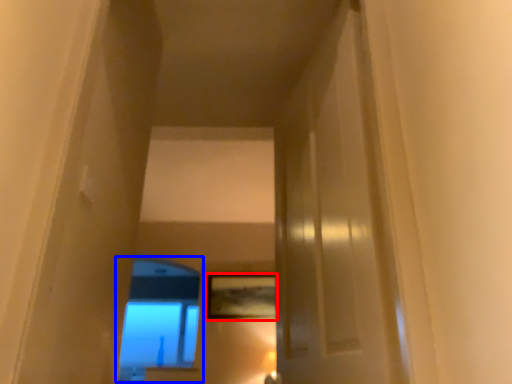
Question: Which point is closer to the camera, picture frame (highlighted by a red box) or window (highlighted by a blue box)?

Choices:
 (A) picture frame
 (B) window

Answer: (A)